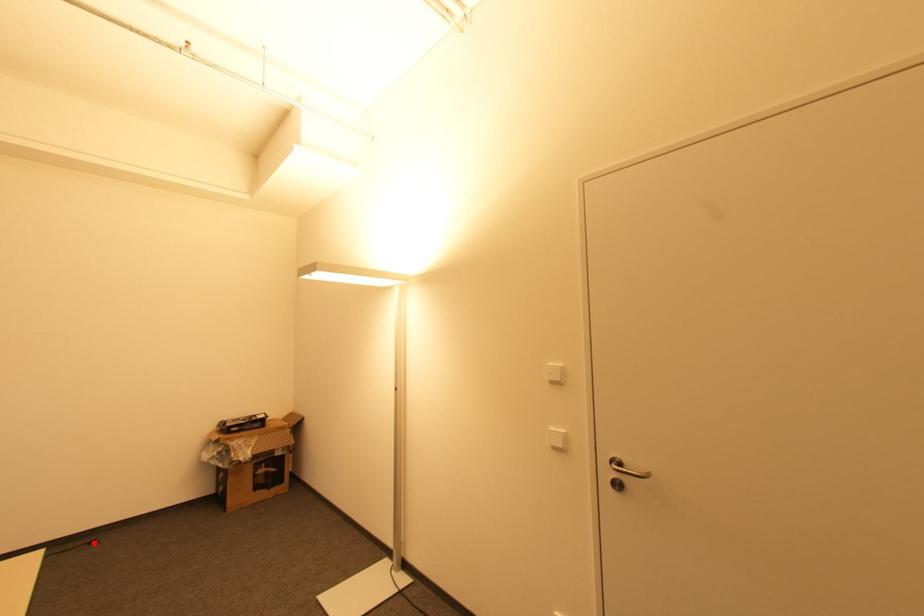
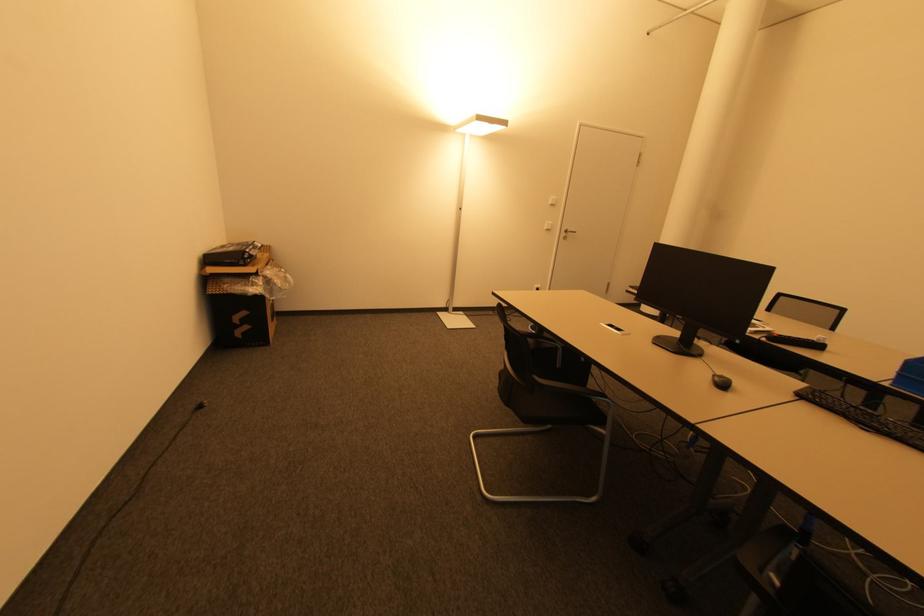
Where in the second image is the point corresponding to the highlighted location from the first image?

(201, 408)